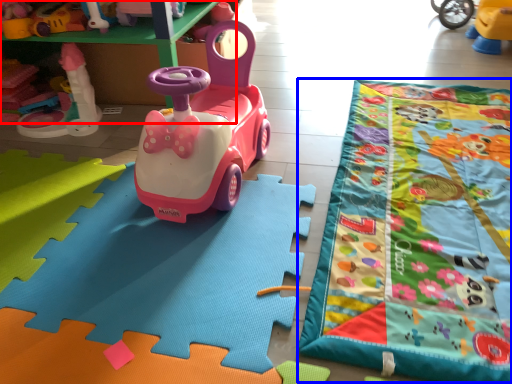
Question: Which object is closer to the camera taking this photo, toy (highlighted by a red box) or blanket (highlighted by a blue box)?

Choices:
 (A) toy
 (B) blanket

Answer: (B)